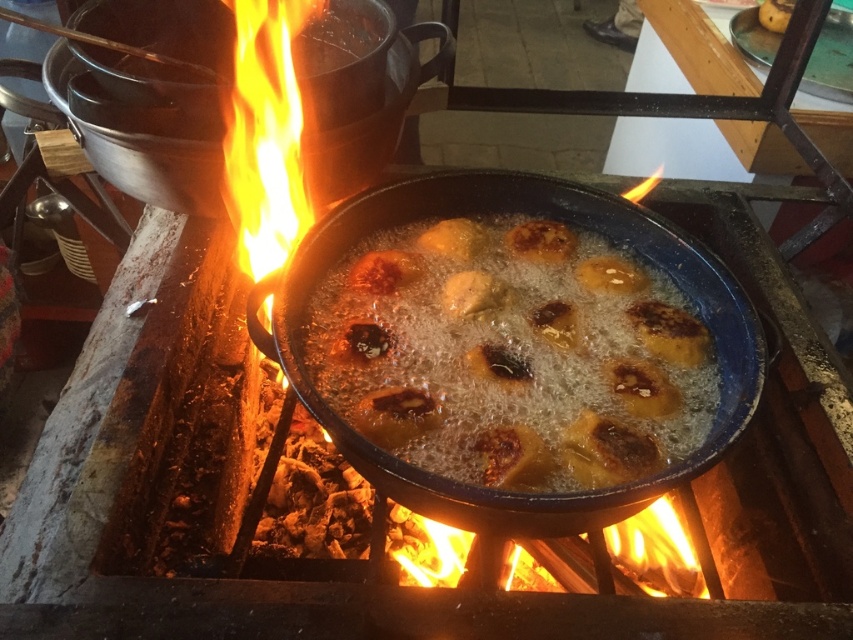
You are a chef preparing a dish and need to know if the golden crispy pastry at center will fit into the black cast iron frying pan at center. Can you determine if it will fit based on their sizes?

The golden crispy pastry at center is not as tall as the black cast iron frying pan at center, so it should fit inside the pan.

You are a chef trying to flip the golden crispy pastry at center and the black cast iron frying pan at center. Which one should you flip first?

The golden crispy pastry at center should be flipped first because it is located below the black cast iron frying pan at center, so you need to flip it before reaching the pan.